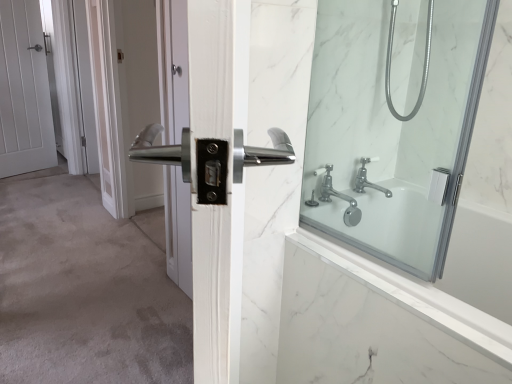
The height and width of the screenshot is (384, 512). Describe the element at coordinates (24, 91) in the screenshot. I see `white matte door at left` at that location.

Locate an element on the screen. silver metallic hose at upper right is located at coordinates coord(423,64).

How far apart are clear glass shower door at right and polished silver handle at center, the second screen door in the back-to-front sequence?

clear glass shower door at right and polished silver handle at center, the second screen door in the back-to-front sequence, are 1.42 meters apart.

How many degrees apart are the facing directions of clear glass shower door at right and polished silver handle at center, arranged as the 1th screen door when viewed from the front?

The angle between the facing direction of clear glass shower door at right and the facing direction of polished silver handle at center, arranged as the 1th screen door when viewed from the front, is 0.418 degrees.

Consider the image. From the image's perspective, is clear glass shower door at right located above polished silver handle at center, marked as the 2th screen door in a left-to-right arrangement?

No, from the image's perspective, clear glass shower door at right is not over polished silver handle at center, marked as the 2th screen door in a left-to-right arrangement.

Who is smaller, clear glass shower door at right or polished silver handle at center, arranged as the 1th screen door when viewed from the front?

With smaller size is clear glass shower door at right.

Is point (156, 180) positioned before point (325, 139)?

No, it is not.

From a real-world perspective, which is physically below, polished silver handle at center, the 1th screen door positioned from the right, or clear glass shower door at right?

polished silver handle at center, the 1th screen door positioned from the right, from a real-world perspective.

Are polished silver handle at center, the 1th screen door positioned from the right, and clear glass shower door at right far apart?

polished silver handle at center, the 1th screen door positioned from the right, is far away from clear glass shower door at right.

Is chrome metallic faucet at upper right aimed at white matte door at left?

No, chrome metallic faucet at upper right does not turn towards white matte door at left.

Choose the correct answer: Is chrome metallic faucet at upper right inside white matte door at left or outside it?

chrome metallic faucet at upper right lies outside white matte door at left.

What's the angular difference between chrome metallic faucet at upper right and white matte door at left's facing directions?

The angle between the facing direction of chrome metallic faucet at upper right and the facing direction of white matte door at left is 19.3 degrees.

Between chrome metallic faucet at upper right and white matte door at left, which one has more height?

white matte door at left.

Is silver metallic hose at upper right at the back of polished silver handle at center, the second screen door in the back-to-front sequence?

That's not correct — polished silver handle at center, the second screen door in the back-to-front sequence, is not looking away from silver metallic hose at upper right.

Considering the relative sizes of polished silver handle at center, marked as the 2th screen door in a left-to-right arrangement, and silver metallic hose at upper right in the image provided, is polished silver handle at center, marked as the 2th screen door in a left-to-right arrangement, bigger than silver metallic hose at upper right?

Yes.

Does polished silver handle at center, the 1th screen door positioned from the right, have a lesser width compared to silver metallic hose at upper right?

No.

Looking at this image, from a real-world perspective, does white matte door at left sit lower than silver metallic hose at upper right?

Yes, from a real-world perspective, white matte door at left is below silver metallic hose at upper right.

Is white matte door at left not inside silver metallic hose at upper right?

Yes, white matte door at left is not within silver metallic hose at upper right.

Relative to silver metallic hose at upper right, is white matte door at left in front or behind?

Visually, white matte door at left is located behind silver metallic hose at upper right.

At what (x,y) coordinates should I click in order to perform the action: click on door above the silver metallic hose at upper right (from the image's perspective). Please return your answer as a coordinate pair (x, y). The height and width of the screenshot is (384, 512). Looking at the image, I should click on (24, 91).

From a real-world perspective, is white marble bath at right below silver metallic hose at upper right?

Yes, from a real-world perspective, white marble bath at right is below silver metallic hose at upper right.

Would you consider white marble bath at right to be distant from silver metallic hose at upper right?

No, white marble bath at right is not far from silver metallic hose at upper right.

Does point (485, 353) come behind point (424, 90)?

No, it is in front of (424, 90).

Is chrome metallic faucet at upper right positioned in front of white marble bath at right?

No.

Between chrome metallic faucet at upper right and white marble bath at right, which one has more height?

With more height is white marble bath at right.

From the image's perspective, is chrome metallic faucet at upper right over white marble bath at right?

Yes, from the image's perspective, chrome metallic faucet at upper right is on top of white marble bath at right.

How different are the orientations of chrome metallic faucet at upper right and white marble bath at right in degrees?

90 degrees separate the facing orientations of chrome metallic faucet at upper right and white marble bath at right.

Which screen door is the 1st one when counting from the left side of the clear glass shower door at right? Please provide its 2D coordinates.

[(132, 96)]

Identify the location of the 1st screen door behind the clear glass shower door at right. The height and width of the screenshot is (384, 512). (132, 96).

From the image, which object appears to be farther from white matte door at left, white marble bath at right or white glossy door at upper left, which is counted as the first screen door, starting from the left?

white marble bath at right.

Considering their positions, is polished silver handle at center, arranged as the 1th screen door when viewed from the front, positioned closer to silver metallic hose at upper right than chrome metallic faucet at upper right?

chrome metallic faucet at upper right is positioned closer to the anchor silver metallic hose at upper right.

Looking at the image, which one is located closer to white matte door at left, silver metallic hose at upper right or white glossy door at upper left, the second screen door when ordered from right to left?

white glossy door at upper left, the second screen door when ordered from right to left, is positioned closer to the anchor white matte door at left.

Based on their spatial positions, is clear glass shower door at right or silver metallic hose at upper right closer to white marble bath at right?

clear glass shower door at right.

Looking at the image, which one is located further to silver metallic hose at upper right, clear glass shower door at right or polished silver handle at center, the second screen door in the back-to-front sequence?

Based on the image, polished silver handle at center, the second screen door in the back-to-front sequence, appears to be further to silver metallic hose at upper right.

Looking at the image, which one is located closer to white matte door at left, chrome metallic faucet at upper right or polished silver handle at center, the 1th screen door positioned from the right?

polished silver handle at center, the 1th screen door positioned from the right, is positioned closer to the anchor white matte door at left.

When comparing their distances from white glossy door at upper left, which is counted as the first screen door, starting from the left, does white marble bath at right or white matte door at left seem further?

Based on the image, white marble bath at right appears to be further to white glossy door at upper left, which is counted as the first screen door, starting from the left.

Based on the photo, from the image, which object appears to be nearer to polished silver handle at center, the 1th screen door positioned from the right, clear glass shower door at right or white glossy door at upper left, arranged as the 2th screen door when viewed from the front?

white glossy door at upper left, arranged as the 2th screen door when viewed from the front.

Find the location of `bath between clear glass shower door at right and chrome metallic faucet at upper right from front to back`. bath between clear glass shower door at right and chrome metallic faucet at upper right from front to back is located at coordinates (378, 323).

Where is `screen door positioned between silver metallic hose at upper right and white glossy door at upper left, arranged as the 2th screen door when viewed from the front, from near to far`? The height and width of the screenshot is (384, 512). screen door positioned between silver metallic hose at upper right and white glossy door at upper left, arranged as the 2th screen door when viewed from the front, from near to far is located at coordinates [132, 96].

Locate an element on the screen. The image size is (512, 384). mirror located between polished silver handle at center, marked as the 2th screen door in a left-to-right arrangement, and white marble bath at right in the left-right direction is located at coordinates (393, 123).

Identify the location of tap between polished silver handle at center, the 1th screen door positioned from the right, and white marble bath at right from left to right. (338, 197).